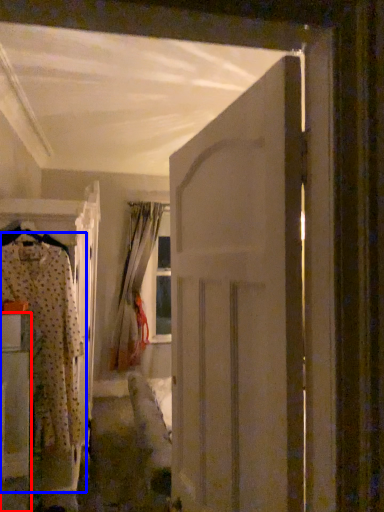
Question: Which of the following is the closest to the observer, furniture (highlighted by a red box) or clothing (highlighted by a blue box)?

Choices:
 (A) furniture
 (B) clothing

Answer: (A)